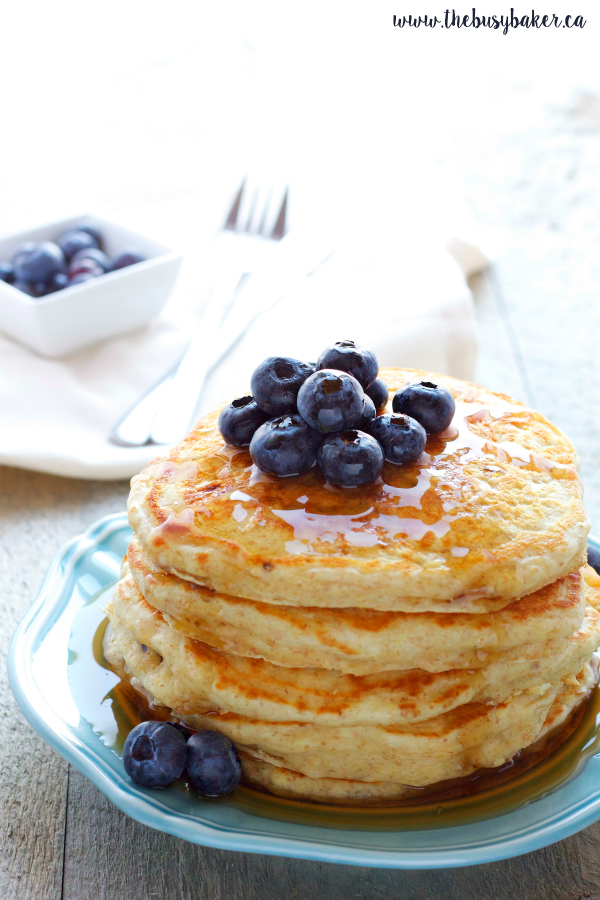
Where is `wood plank tabletop`? wood plank tabletop is located at coordinates (96, 858), (37, 522), (543, 345).